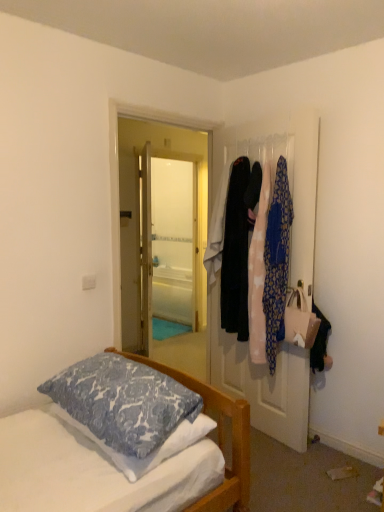
Question: Does blue printed pillow at lower left turn towards patterned fabric clothesline at upper right?

Choices:
 (A) yes
 (B) no

Answer: (B)

Question: Is blue printed pillow at lower left wider than patterned fabric clothesline at upper right?

Choices:
 (A) no
 (B) yes

Answer: (B)

Question: Is blue printed pillow at lower left turned away from patterned fabric clothesline at upper right?

Choices:
 (A) yes
 (B) no

Answer: (B)

Question: From the image's perspective, would you say blue printed pillow at lower left is shown under patterned fabric clothesline at upper right?

Choices:
 (A) no
 (B) yes

Answer: (B)

Question: Is blue printed pillow at lower left positioned in front of patterned fabric clothesline at upper right?

Choices:
 (A) no
 (B) yes

Answer: (B)

Question: From a real-world perspective, is blue printed pillow at lower left positioned under patterned fabric clothesline at upper right based on gravity?

Choices:
 (A) no
 (B) yes

Answer: (B)

Question: Considering the relative sizes of patterned fabric clothesline at upper right and blue printed pillow at lower left in the image provided, is patterned fabric clothesline at upper right thinner than blue printed pillow at lower left?

Choices:
 (A) no
 (B) yes

Answer: (B)

Question: Is patterned fabric clothesline at upper right shorter than blue printed pillow at lower left?

Choices:
 (A) yes
 (B) no

Answer: (B)

Question: From a real-world perspective, is patterned fabric clothesline at upper right physically above blue printed pillow at lower left?

Choices:
 (A) yes
 (B) no

Answer: (A)

Question: From the image's perspective, does patterned fabric clothesline at upper right appear lower than blue printed pillow at lower left?

Choices:
 (A) no
 (B) yes

Answer: (A)

Question: Is patterned fabric clothesline at upper right positioned with its back to blue printed pillow at lower left?

Choices:
 (A) no
 (B) yes

Answer: (A)

Question: Considering the relative sizes of patterned fabric clothesline at upper right and blue printed pillow at lower left in the image provided, is patterned fabric clothesline at upper right wider than blue printed pillow at lower left?

Choices:
 (A) no
 (B) yes

Answer: (A)

Question: Can you confirm if white glossy door at center is smaller than blue printed pillow at lower left?

Choices:
 (A) no
 (B) yes

Answer: (A)